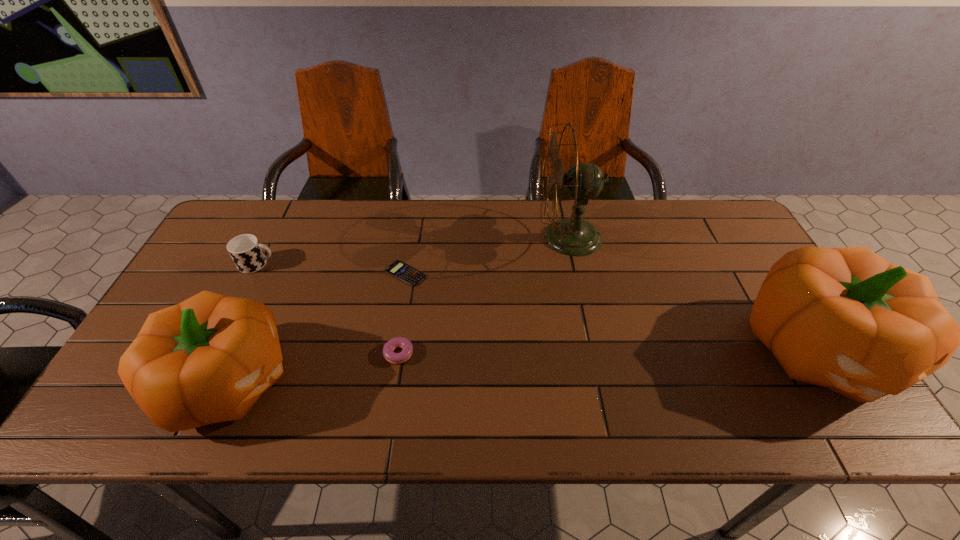
What are the coordinates of `the third tallest object` in the screenshot? It's located at (208, 359).

I want to click on the shorter pumpkin, so click(x=208, y=359).

Locate an element on the screen. the right pumpkin is located at coordinates (x=846, y=319).

Identify the location of the taller pumpkin. This screenshot has height=540, width=960. (846, 319).

The width and height of the screenshot is (960, 540). Identify the location of the tallest object. (573, 236).

Locate an element on the screen. This screenshot has width=960, height=540. fan is located at coordinates (573, 236).

The width and height of the screenshot is (960, 540). What are the coordinates of `calculator` in the screenshot? It's located at (398, 269).

Image resolution: width=960 pixels, height=540 pixels. I want to click on cup, so click(x=246, y=251).

Locate an element on the screen. the fifth tallest object is located at coordinates (407, 348).

Find the location of `vacant point located on the carved face of the third tallest object`. vacant point located on the carved face of the third tallest object is located at coordinates pos(364,381).